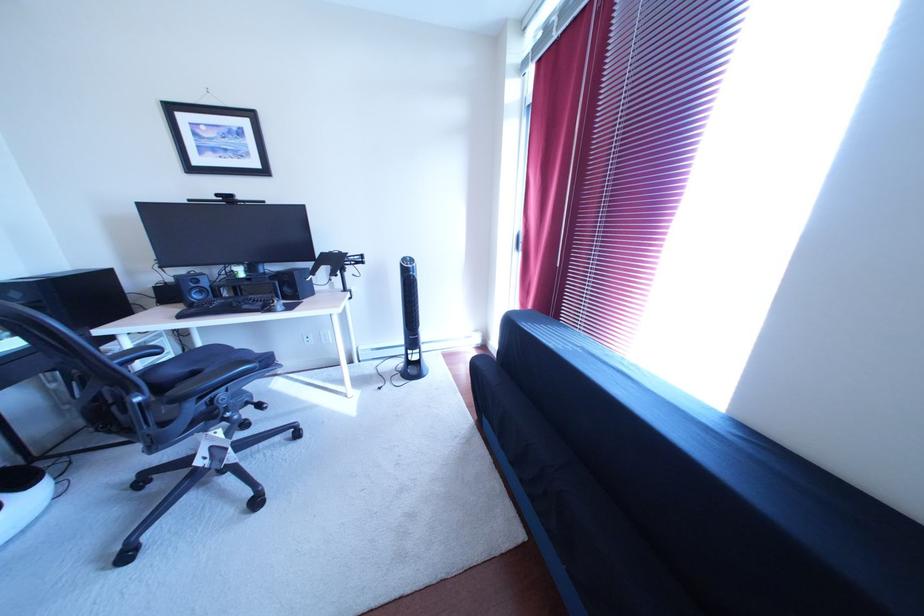
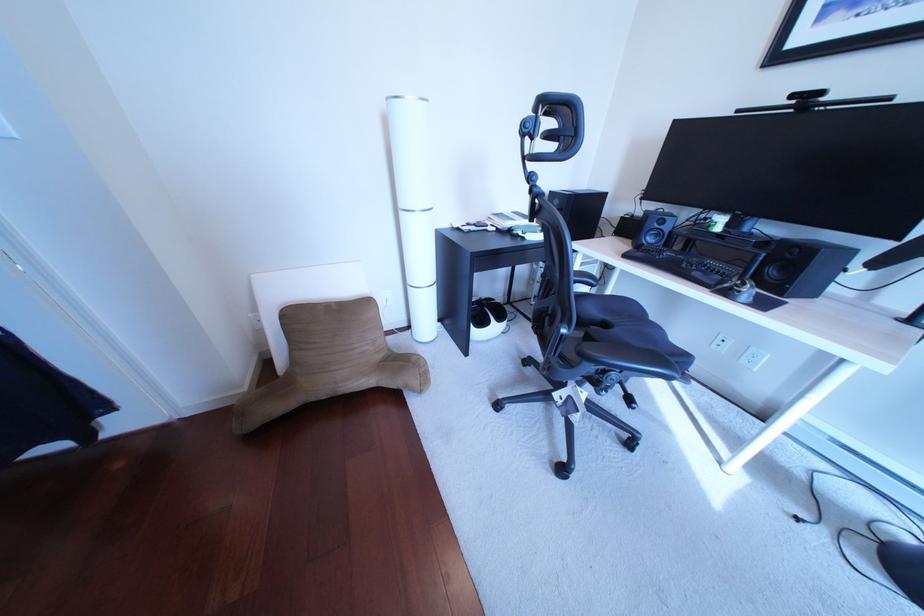
The first image is from the beginning of the video and the second image is from the end. How did the camera likely rotate when shooting the video?

The camera rotated toward left-down.